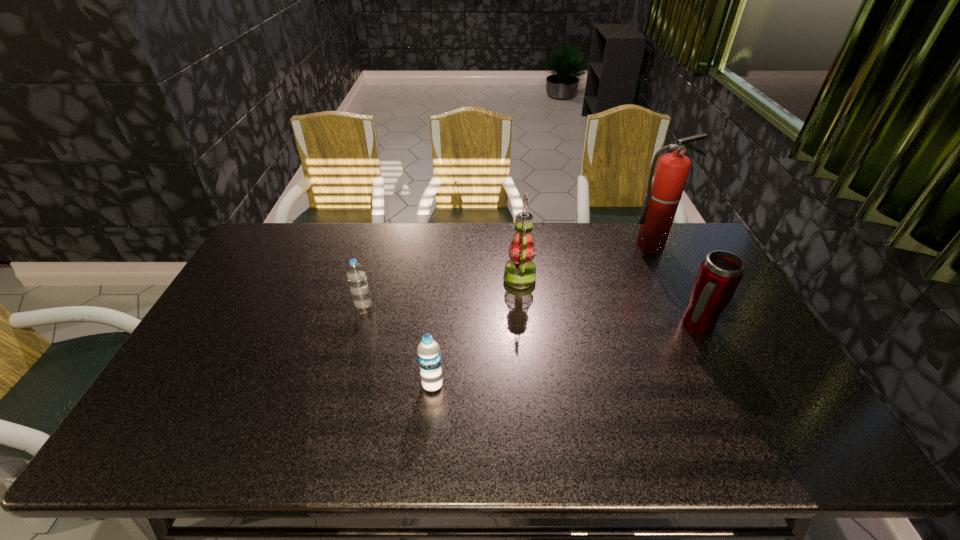
You are a GUI agent. You are given a task and a screenshot of the screen. Output one action in this format:
    pyautogui.click(x=<x>, y=<y>)
    Task: Click on the farthest object
    
    Given the screenshot: What is the action you would take?
    pyautogui.click(x=663, y=196)

Where is `fire extinguisher`? This screenshot has width=960, height=540. fire extinguisher is located at coordinates (663, 196).

In order to click on the fourth nearest object in this screenshot , I will do `click(520, 271)`.

At what (x,y) coordinates should I click in order to perform the action: click on oil lamp. Please return your answer as a coordinate pair (x, y). This screenshot has width=960, height=540. Looking at the image, I should click on (520, 271).

Locate an element on the screen. the third shortest object is located at coordinates (719, 275).

Identify the location of the farther water bottle. (356, 275).

Identify the location of the left water bottle. This screenshot has height=540, width=960. click(356, 275).

Identify the location of the nearest object. The width and height of the screenshot is (960, 540). (428, 351).

Identify the location of the right water bottle. This screenshot has width=960, height=540. (428, 351).

At what (x,y) coordinates should I click in order to perform the action: click on blank space located 0.300m with the nozzle and gauge on the farthest object. Please return your answer as a coordinate pair (x, y). Looking at the image, I should click on (686, 315).